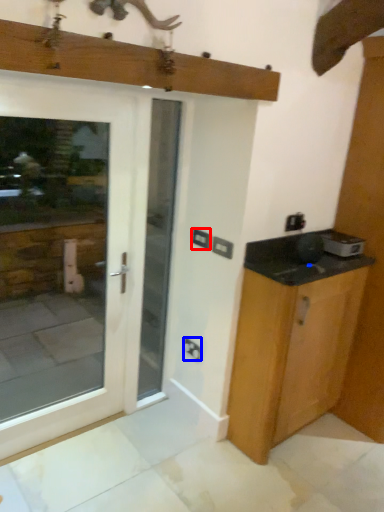
Question: Among these objects, which one is farthest to the camera, electric outlet (highlighted by a red box) or electric outlet (highlighted by a blue box)?

Choices:
 (A) electric outlet
 (B) electric outlet

Answer: (B)